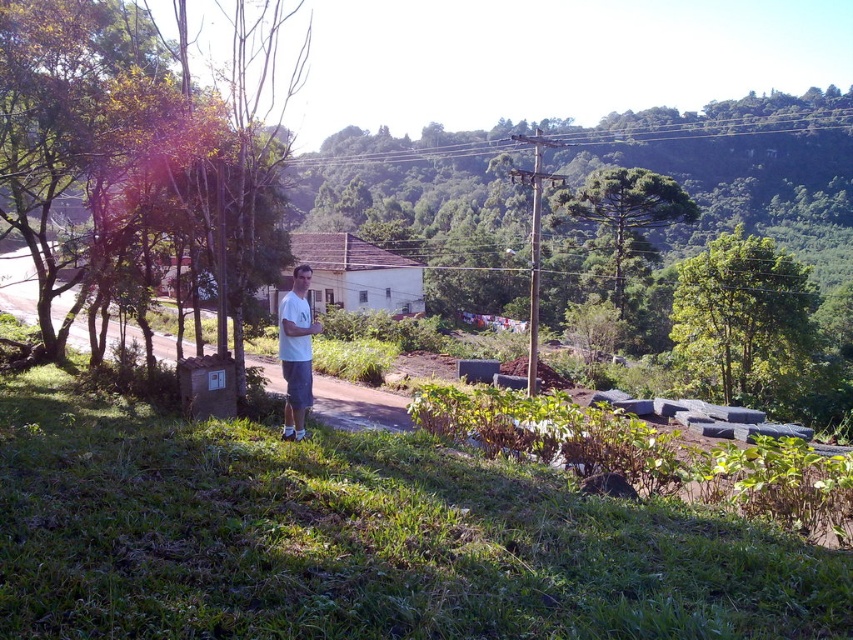
Between green leafy tree at left and white matte shirt at center, which one has more height?

Standing taller between the two is green leafy tree at left.

What are the coordinates of `green leafy tree at left` in the screenshot? It's located at (126, 145).

Is point (694, 257) positioned in front of point (590, 189)?

No, (694, 257) is behind (590, 189).

Between point (793, 353) and point (584, 212), which one is positioned behind?

The point (584, 212) is more distant.

Does point (746, 314) come behind point (599, 188)?

No, (746, 314) is closer to viewer.

Find the location of `green leafy tree at upper right`. green leafy tree at upper right is located at coordinates (741, 321).

Is green leafy tree at upper right in front of white matte shirt at center?

No, it is behind white matte shirt at center.

Does green leafy tree at upper right appear on the left side of white matte shirt at center?

In fact, green leafy tree at upper right is to the right of white matte shirt at center.

Locate an element on the screen. The width and height of the screenshot is (853, 640). green leafy tree at upper right is located at coordinates (741, 321).